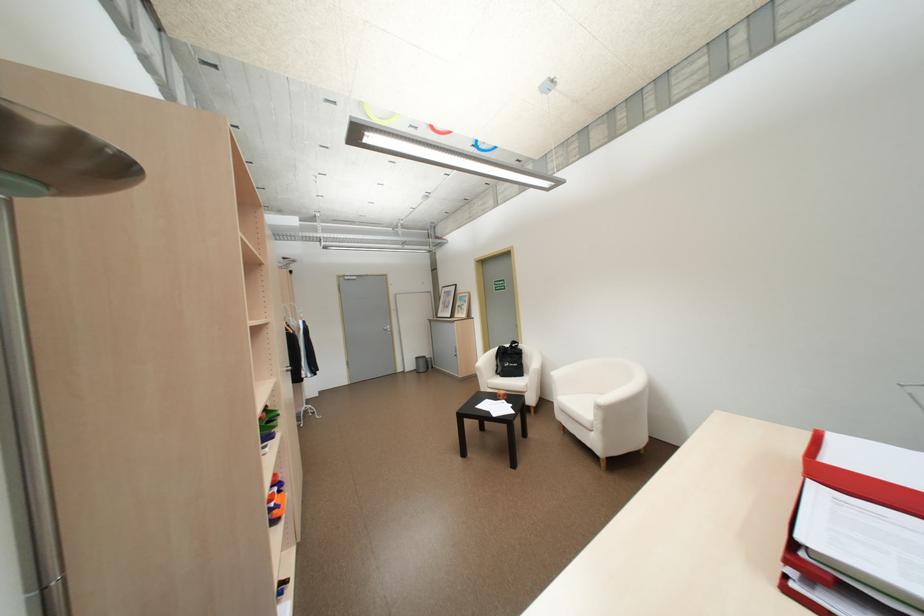
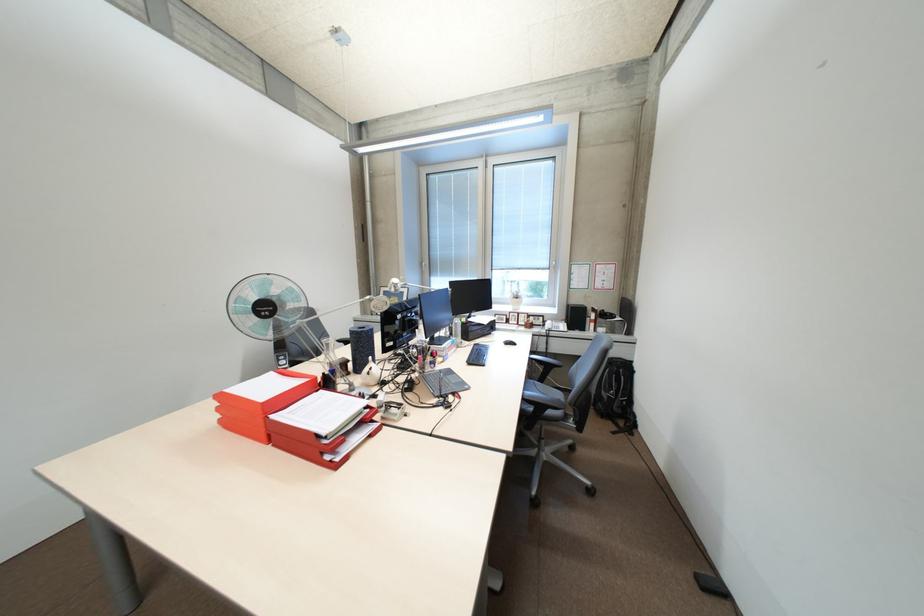
Locate, in the second image, the point that corresponds to point 804,570 in the first image.

(337, 456)